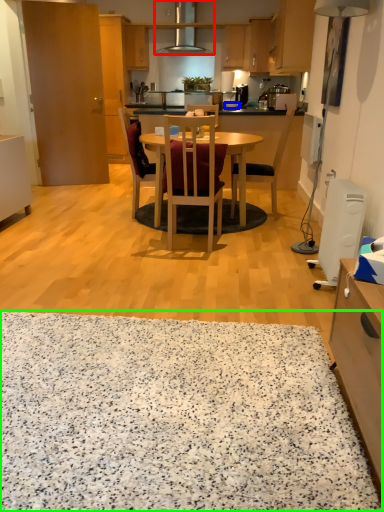
Question: Which object is positioned closest to oven (highlighted by a red box)? Select from plate (highlighted by a blue box) and granite (highlighted by a green box).

Choices:
 (A) plate
 (B) granite

Answer: (A)